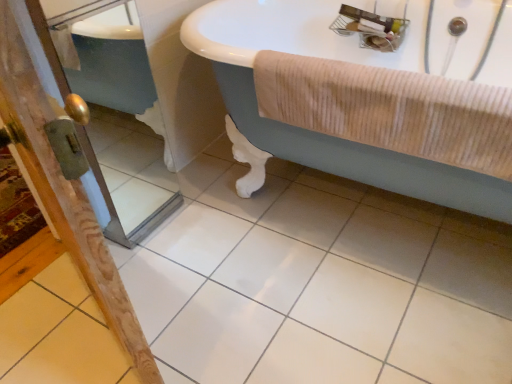
Question: Looking at their shapes, would you say wooden screen door at lower left, the second screen door from the left, is wider or thinner than wooden screen door at left, the second screen door viewed from the right?

Choices:
 (A) thin
 (B) wide

Answer: (B)

Question: Relative to wooden screen door at left, the first screen door positioned from the left, is wooden screen door at lower left, placed as the first screen door when sorted from right to left, in front or behind?

Choices:
 (A) front
 (B) behind

Answer: (A)

Question: Considering the real-world distances, which object is closest to the wooden screen door at lower left, the second screen door from the left?

Choices:
 (A) white glossy bathtub at upper center
 (B) beige corduroy towel at right
 (C) white glossy tile at center
 (D) wooden screen door at left, the second screen door viewed from the right

Answer: (A)

Question: Estimate the real-world distances between objects in this image. Which object is closer to the wooden screen door at left, the first screen door positioned from the left?

Choices:
 (A) white glossy tile at center
 (B) beige corduroy towel at right
 (C) wooden screen door at lower left, placed as the first screen door when sorted from right to left
 (D) white glossy bathtub at upper center

Answer: (B)